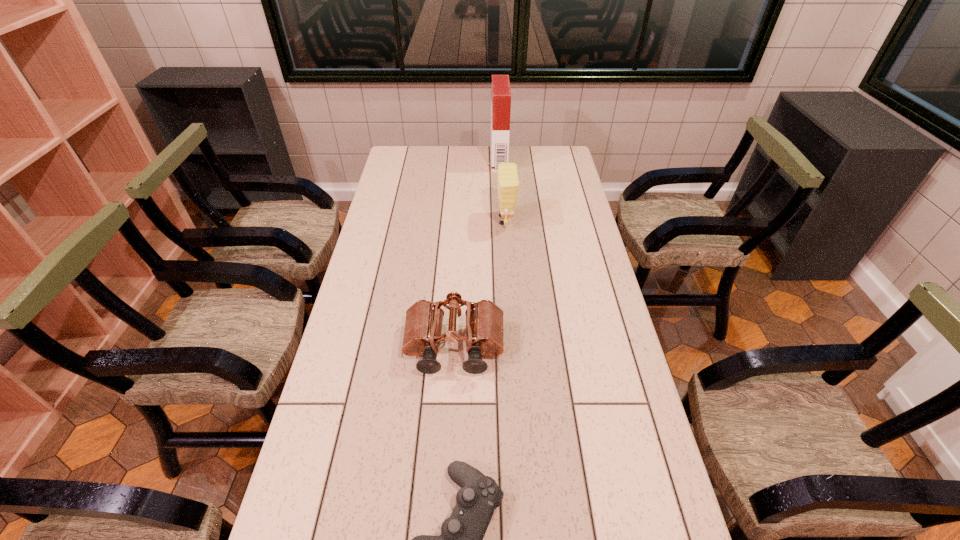
Find the location of `the farthest object`. the farthest object is located at coordinates click(x=501, y=93).

Locate an element on the screen. cigarette_case is located at coordinates (501, 93).

The height and width of the screenshot is (540, 960). Identify the location of the third shortest object. (508, 181).

Where is `sponge`? The height and width of the screenshot is (540, 960). sponge is located at coordinates (508, 181).

This screenshot has width=960, height=540. In order to click on the second shortest object in this screenshot , I will do `click(484, 320)`.

In order to click on binoculars in this screenshot , I will do `click(484, 320)`.

Where is `vacant area located on the front-facing side of the tallest object`? vacant area located on the front-facing side of the tallest object is located at coordinates (475, 159).

Where is `vacant space situated 0.360m on the front-facing side of the tallest object`? vacant space situated 0.360m on the front-facing side of the tallest object is located at coordinates (412, 159).

Locate an element on the screen. Image resolution: width=960 pixels, height=540 pixels. blank space located on the front-facing side of the tallest object is located at coordinates (405, 159).

The height and width of the screenshot is (540, 960). Find the location of `vacant space located on the face of the sponge`. vacant space located on the face of the sponge is located at coordinates (469, 220).